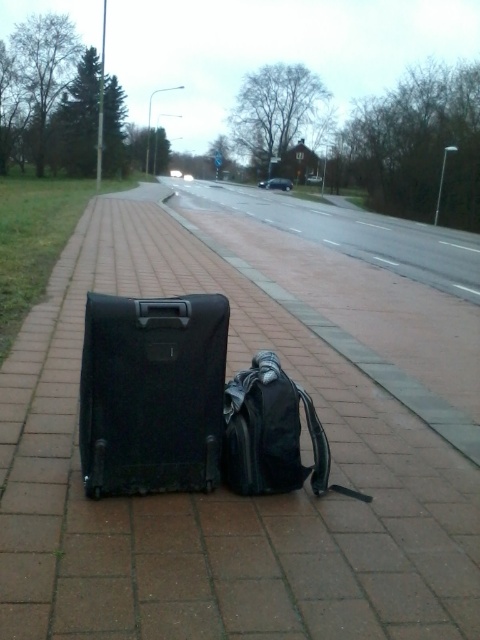
Question: Does black plastic suitcase at center appear on the left side of black matte suitcase at center?

Choices:
 (A) no
 (B) yes

Answer: (A)

Question: Does matte black backpack at center appear under black matte suitcase at left?

Choices:
 (A) no
 (B) yes

Answer: (B)

Question: Which object is farther from the camera taking this photo?

Choices:
 (A) black matte suitcase at left
 (B) black plastic suitcase at center
 (C) matte black backpack at center

Answer: (A)

Question: Estimate the real-world distances between objects in this image. Which object is closer to the matte black backpack at center?

Choices:
 (A) black plastic suitcase at center
 (B) black matte suitcase at left

Answer: (A)

Question: Does black plastic suitcase at center come behind black matte suitcase at left?

Choices:
 (A) yes
 (B) no

Answer: (B)

Question: Which point is farther to the camera?

Choices:
 (A) black matte suitcase at left
 (B) black matte suitcase at center

Answer: (A)